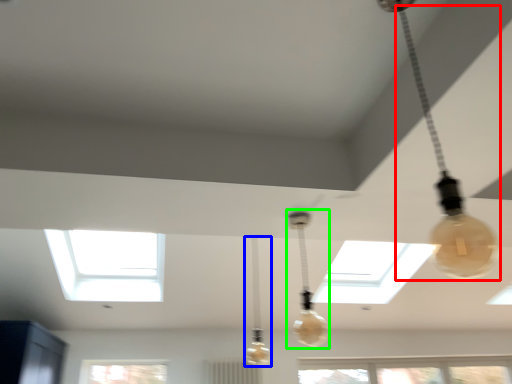
Question: Considering the real-world distances, which object is closest to lamp (highlighted by a red box)? lamp (highlighted by a blue box) or lamp (highlighted by a green box).

Choices:
 (A) lamp
 (B) lamp

Answer: (B)